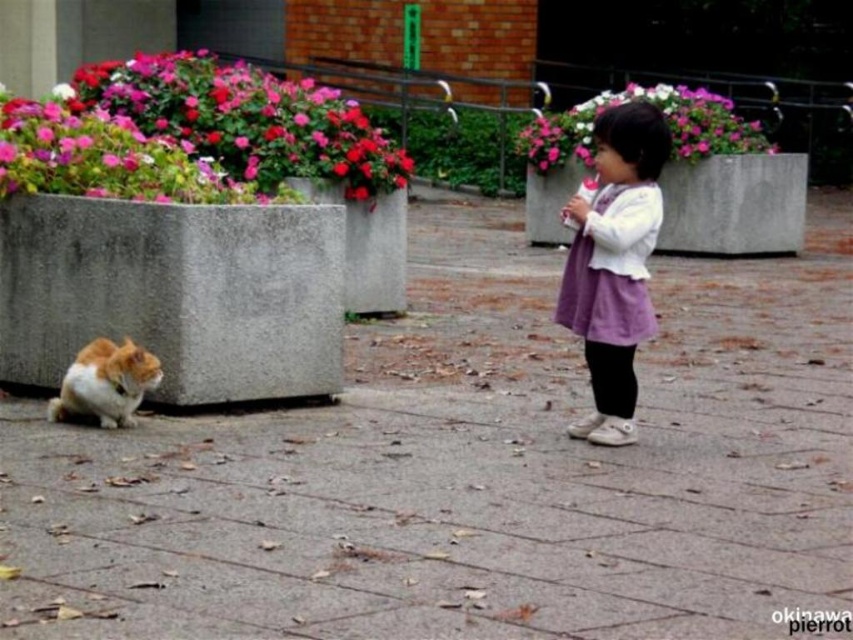
Is point (589, 216) farther from camera compared to point (102, 340)?

No, it is not.

Is purple cotton dress at center below orange and white fur cat at lower left?

No, purple cotton dress at center is not below orange and white fur cat at lower left.

Which is in front, point (631, 260) or point (126, 392)?

Point (631, 260) is in front.

Locate an element on the screen. Image resolution: width=853 pixels, height=640 pixels. purple cotton dress at center is located at coordinates (614, 264).

Does point (764, 294) lie in front of point (64, 396)?

No, it is not.

Does gray concrete pavement at center have a smaller size compared to orange and white fur cat at lower left?

Incorrect, gray concrete pavement at center is not smaller in size than orange and white fur cat at lower left.

Is point (302, 556) in front of point (125, 408)?

That is True.

Find the location of a particular element. Image resolution: width=853 pixels, height=640 pixels. gray concrete pavement at center is located at coordinates coord(471,468).

Where is `gray concrete pavement at center`? This screenshot has height=640, width=853. gray concrete pavement at center is located at coordinates point(471,468).

Can you confirm if gray concrete pavement at center is wider than purple cotton dress at center?

Yes.

Is point (704, 394) behind point (556, 304)?

No, it is not.

This screenshot has width=853, height=640. Identify the location of gray concrete pavement at center. (471, 468).